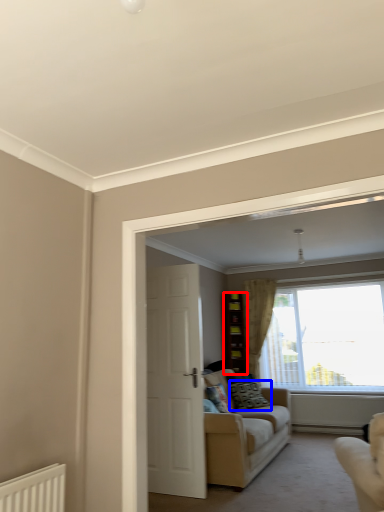
Question: Which object appears farthest to the camera in this image, cabinetry (highlighted by a red box) or pillow (highlighted by a blue box)?

Choices:
 (A) cabinetry
 (B) pillow

Answer: (A)